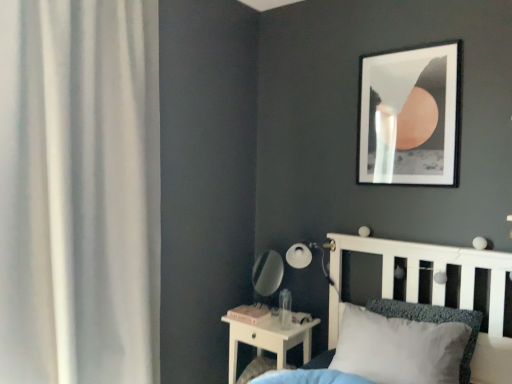
Question: Is white sheer curtain at left looking in the opposite direction of white matte bed at center?

Choices:
 (A) no
 (B) yes

Answer: (A)

Question: Is white sheer curtain at left behind white matte bed at center?

Choices:
 (A) no
 (B) yes

Answer: (B)

Question: Is white sheer curtain at left completely or partially outside of white matte bed at center?

Choices:
 (A) no
 (B) yes

Answer: (B)

Question: From a real-world perspective, is white sheer curtain at left positioned over white matte bed at center based on gravity?

Choices:
 (A) no
 (B) yes

Answer: (B)

Question: Can you confirm if white sheer curtain at left is taller than white matte bed at center?

Choices:
 (A) yes
 (B) no

Answer: (A)

Question: Visually, is shiny silver mirror at center positioned to the left or to the right of matte black table lamp at upper right?

Choices:
 (A) left
 (B) right

Answer: (A)

Question: From the image's perspective, is shiny silver mirror at center above or below matte black table lamp at upper right?

Choices:
 (A) above
 (B) below

Answer: (B)

Question: From a real-world perspective, is shiny silver mirror at center physically located above or below matte black table lamp at upper right?

Choices:
 (A) below
 (B) above

Answer: (A)

Question: Considering the positions of shiny silver mirror at center and matte black table lamp at upper right in the image, is shiny silver mirror at center taller or shorter than matte black table lamp at upper right?

Choices:
 (A) short
 (B) tall

Answer: (B)

Question: Considering the positions of point (472, 340) and point (271, 263), is point (472, 340) closer or farther from the camera than point (271, 263)?

Choices:
 (A) farther
 (B) closer

Answer: (B)

Question: Considering their positions, is white soft pillow at center located in front of or behind shiny silver mirror at center?

Choices:
 (A) behind
 (B) front

Answer: (B)

Question: Is white soft pillow at center taller or shorter than shiny silver mirror at center?

Choices:
 (A) short
 (B) tall

Answer: (A)

Question: Considering the positions of white soft pillow at center and shiny silver mirror at center in the image, is white soft pillow at center wider or thinner than shiny silver mirror at center?

Choices:
 (A) wide
 (B) thin

Answer: (A)

Question: Based on their sizes in the image, would you say white sheer curtain at left is bigger or smaller than shiny silver mirror at center?

Choices:
 (A) big
 (B) small

Answer: (A)

Question: Do you think white sheer curtain at left is within shiny silver mirror at center, or outside of it?

Choices:
 (A) inside
 (B) outside

Answer: (B)